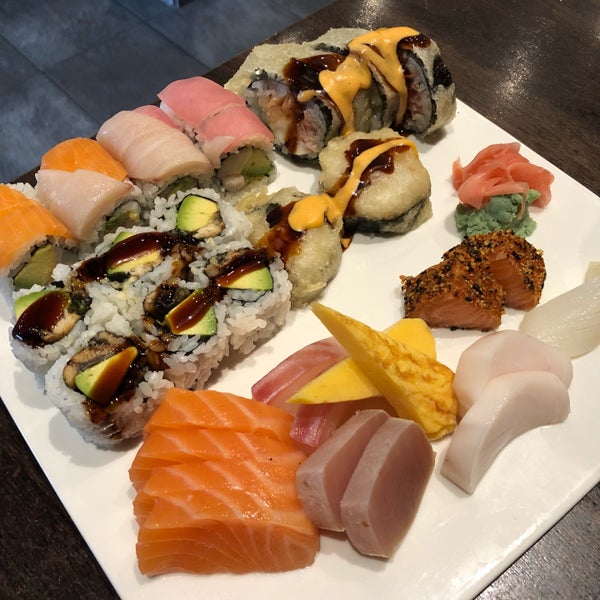
The width and height of the screenshot is (600, 600). Find the location of `tiled floor`. tiled floor is located at coordinates (113, 49).